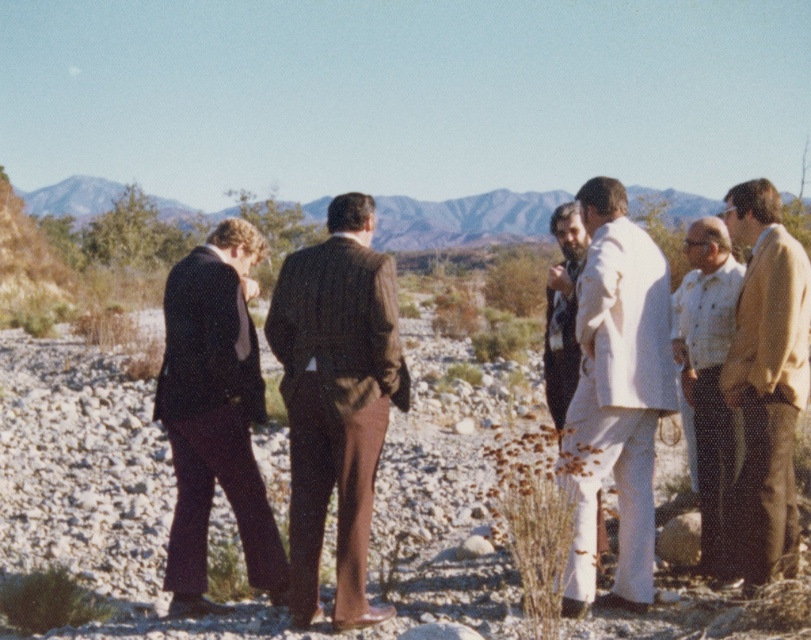
Question: Which of these objects is positioned farthest from the white matte suit at right?

Choices:
 (A) white cotton shirt at right
 (B) white textured shirt at right
 (C) brown wool suit at center
 (D) dark brown suit at left

Answer: (A)

Question: Is dark brown suit at left closer to the viewer compared to tan suede jacket at right?

Choices:
 (A) no
 (B) yes

Answer: (A)

Question: Which object appears farthest from the camera in this image?

Choices:
 (A) white textured shirt at right
 (B) dark brown suit at left
 (C) white cotton shirt at right

Answer: (A)

Question: Based on their relative distances, which object is farther from the white textured shirt at right?

Choices:
 (A) white cotton shirt at right
 (B) tan suede jacket at right
 (C) white matte suit at right

Answer: (A)

Question: Is tan suede jacket at right positioned in front of white textured shirt at right?

Choices:
 (A) no
 (B) yes

Answer: (B)

Question: Does white matte suit at right have a lesser width compared to dark brown suit at left?

Choices:
 (A) no
 (B) yes

Answer: (B)